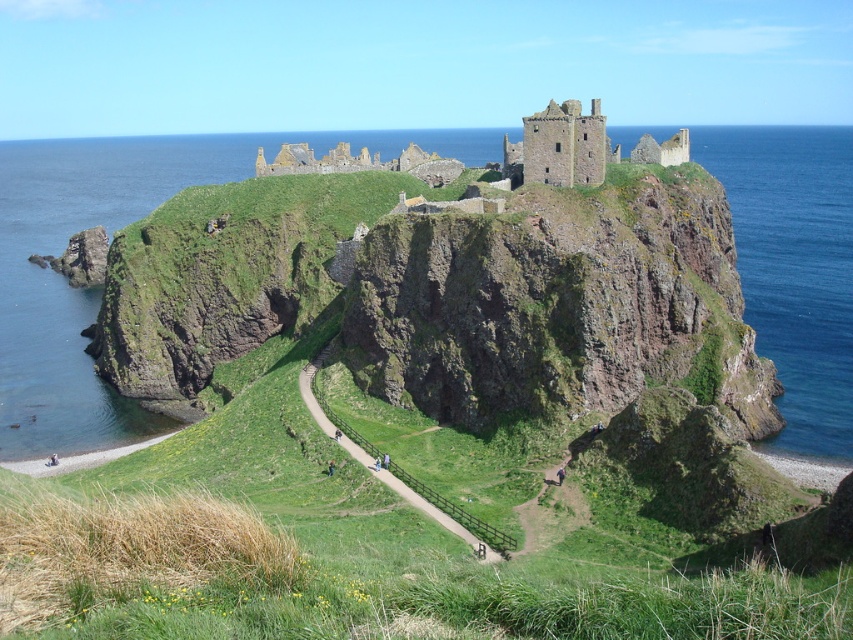
Question: Based on their relative distances, which object is nearer to the blue water at upper left?

Choices:
 (A) green grassy path at center
 (B) brown stone castle at upper center

Answer: (B)

Question: Does blue water at upper left appear over brown stone castle at upper center?

Choices:
 (A) no
 (B) yes

Answer: (B)

Question: Is brown stone castle at upper center bigger than green grassy path at center?

Choices:
 (A) no
 (B) yes

Answer: (B)

Question: Which is farther from the green grassy path at center?

Choices:
 (A) brown stone castle at upper center
 (B) blue water at upper left

Answer: (B)

Question: Does brown stone castle at upper center appear under green grassy path at center?

Choices:
 (A) yes
 (B) no

Answer: (B)

Question: Which object is closer to the camera taking this photo?

Choices:
 (A) blue water at upper left
 (B) brown stone castle at upper center

Answer: (A)